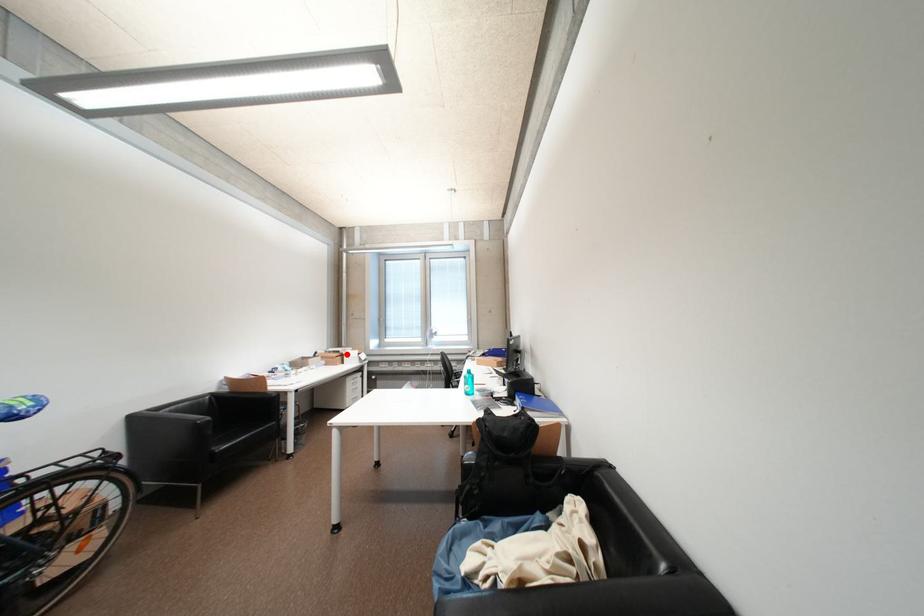
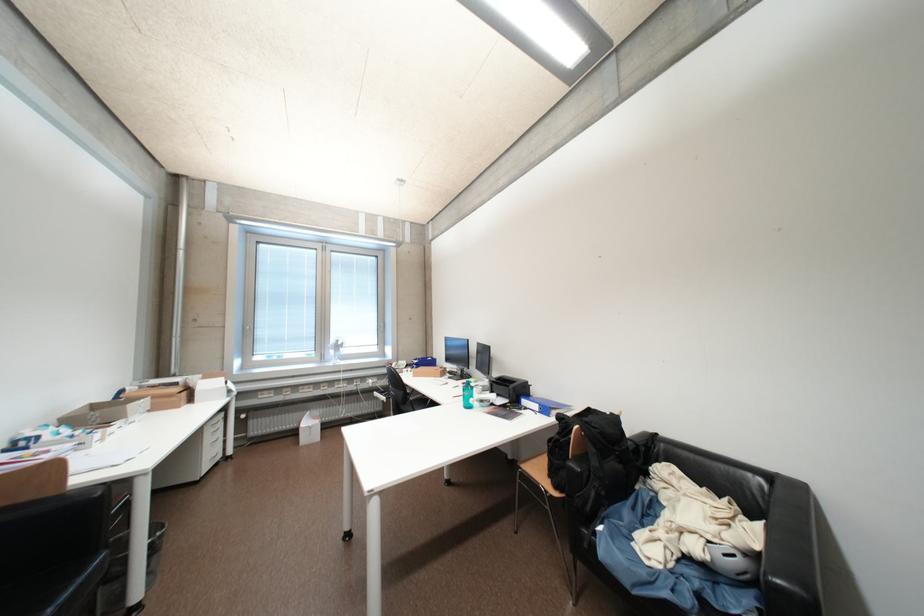
Question: I am providing you with two images of the same scene from different viewpoints. A red point is shown in image1. For the corresponding object point in image2, is it positioned nearer or farther from the camera?

Choices:
 (A) Nearer
 (B) Farther

Answer: (A)